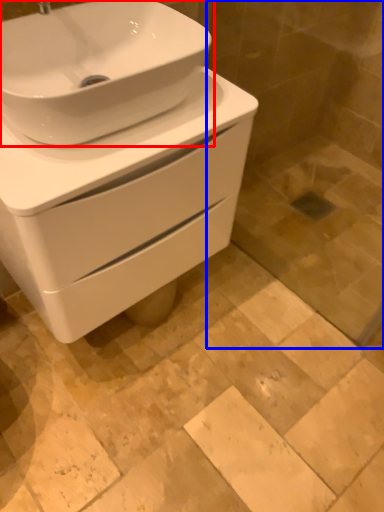
Question: Which object appears closest to the camera in this image, sink (highlighted by a red box) or glass door (highlighted by a blue box)?

Choices:
 (A) sink
 (B) glass door

Answer: (A)